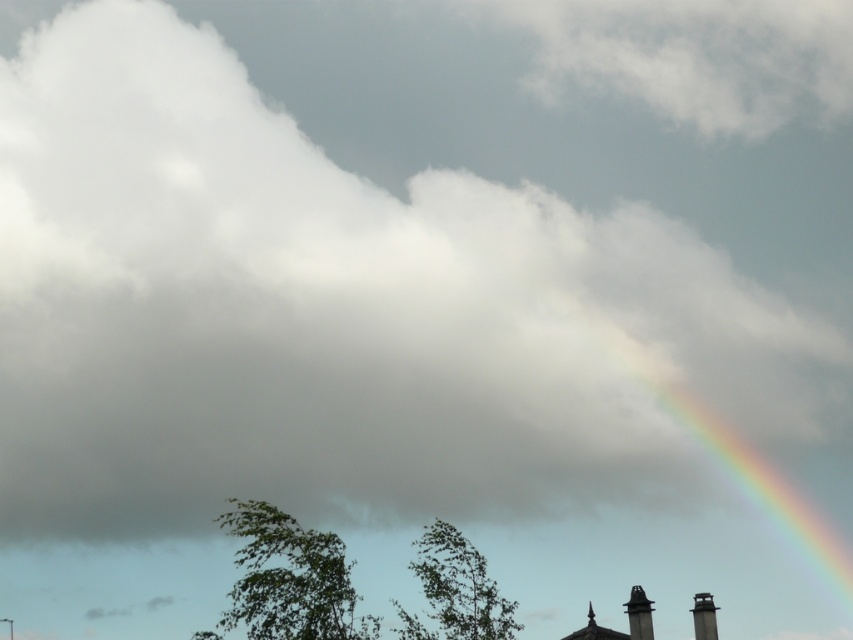
Is rainbow at upper right behind gray metallic chimney at lower right?

No, rainbow at upper right is closer to the viewer.

Who is positioned more to the left, rainbow at upper right or gray metallic chimney at lower right?

Positioned to the left is gray metallic chimney at lower right.

Describe the element at coordinates (741, 461) in the screenshot. The image size is (853, 640). I see `rainbow at upper right` at that location.

At what (x,y) coordinates should I click in order to perform the action: click on rainbow at upper right. Please return your answer as a coordinate pair (x, y). The height and width of the screenshot is (640, 853). Looking at the image, I should click on (741, 461).

Does black matte chimney at lower right have a greater height compared to gray metallic chimney at lower right?

Incorrect, black matte chimney at lower right's height is not larger of gray metallic chimney at lower right's.

Does point (634, 586) lie in front of point (694, 600)?

Yes, it is.

Where is `black matte chimney at lower right`? This screenshot has height=640, width=853. black matte chimney at lower right is located at coordinates (639, 614).

Who is more forward, (416, 572) or (639, 588)?

Point (416, 572)

Between green leafy tree at center and black matte chimney at lower right, which one is positioned lower?

black matte chimney at lower right is below.

Locate an element on the screen. green leafy tree at center is located at coordinates (460, 586).

Locate an element on the screen. This screenshot has height=640, width=853. green leafy tree at center is located at coordinates (460, 586).